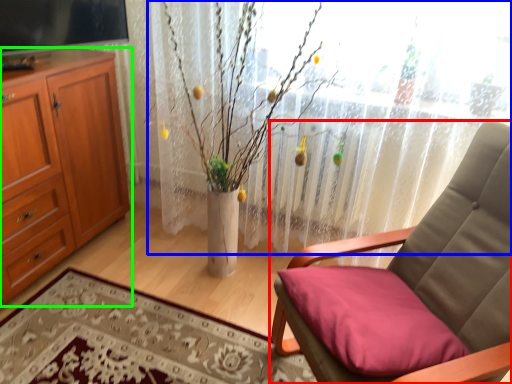
Question: Which is nearer to the chair (highlighted by a red box)? curtain (highlighted by a blue box) or cabinetry (highlighted by a green box).

Choices:
 (A) curtain
 (B) cabinetry

Answer: (A)